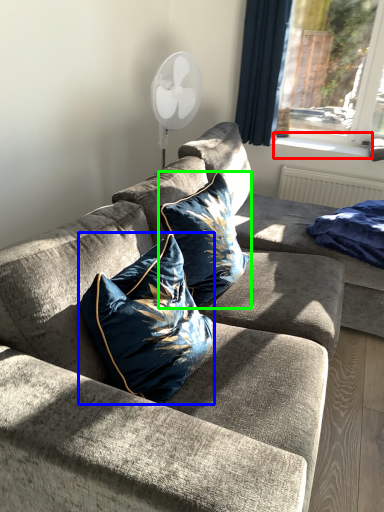
Question: Which is nearer to the window sill (highlighted by a red box)? pillow (highlighted by a blue box) or pillow (highlighted by a green box).

Choices:
 (A) pillow
 (B) pillow

Answer: (B)